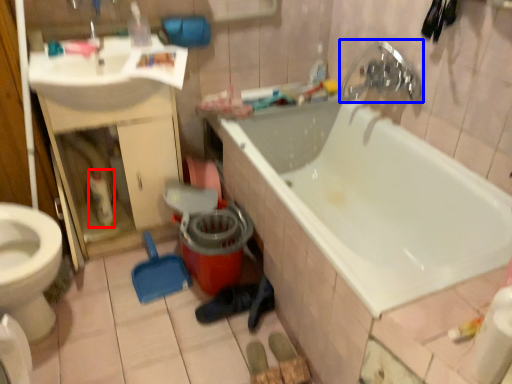
Question: Which point is further to the camera, cleaning product (highlighted by a red box) or tap (highlighted by a blue box)?

Choices:
 (A) cleaning product
 (B) tap

Answer: (A)